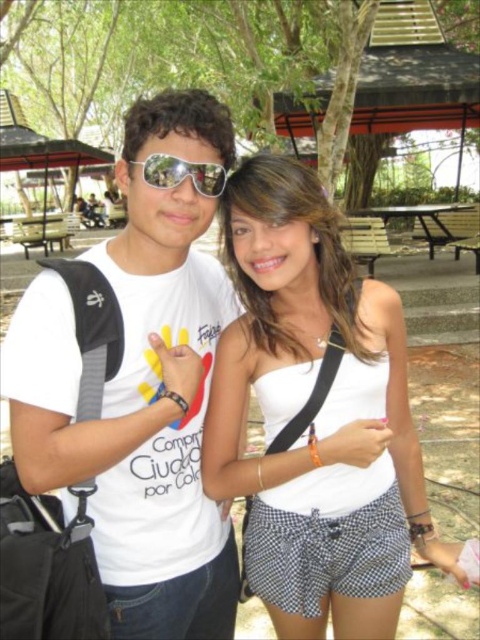
Is the position of brown wooden picnic table at center less distant than that of sunglasses at center?

That is False.

What are the coordinates of `brown wooden picnic table at center` in the screenshot? It's located at (432, 220).

Where is `brown wooden picnic table at center`? The height and width of the screenshot is (640, 480). brown wooden picnic table at center is located at coordinates (432, 220).

Describe the element at coordinates (324, 554) in the screenshot. I see `checkered fabric shorts at lower center` at that location.

Between point (347, 573) and point (467, 234), which one is positioned in front?

Positioned in front is point (347, 573).

Find the location of `checkered fabric shorts at lower center`. checkered fabric shorts at lower center is located at coordinates (324, 554).

Is checkered fabric shorts at lower center taller than sunglasses at center?

Yes.

Between point (372, 529) and point (206, 177), which one is positioned behind?

The point (372, 529) is more distant.

Is point (282, 595) positioned after point (180, 182)?

That is True.

Locate an element on the screen. Image resolution: width=480 pixels, height=640 pixels. checkered fabric shorts at lower center is located at coordinates (324, 554).